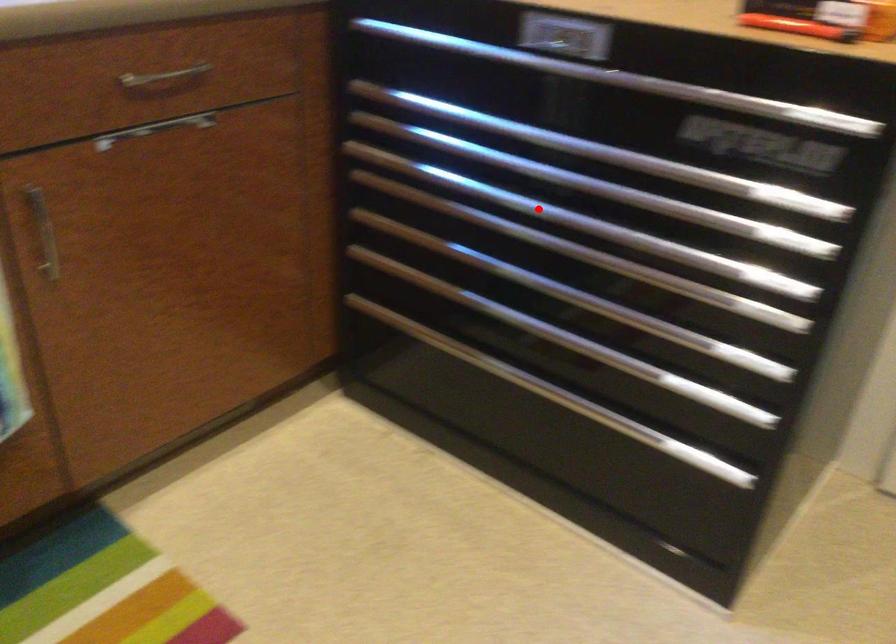
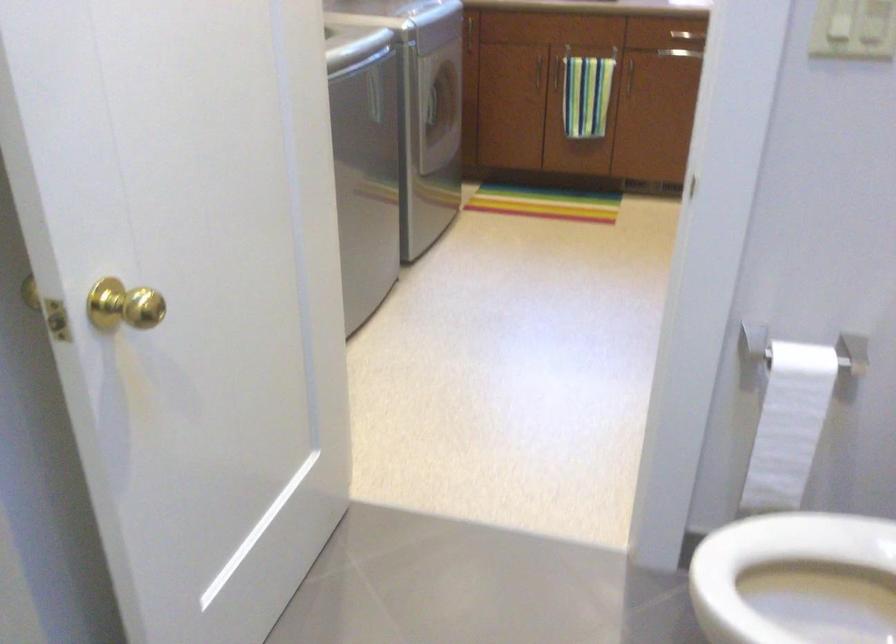
Question: I am providing you with two images of the same scene from different viewpoints. A red point is marked on the first image. At the location where the point appears in image 1, is it still visible in image 2?

Choices:
 (A) Yes
 (B) No

Answer: (B)